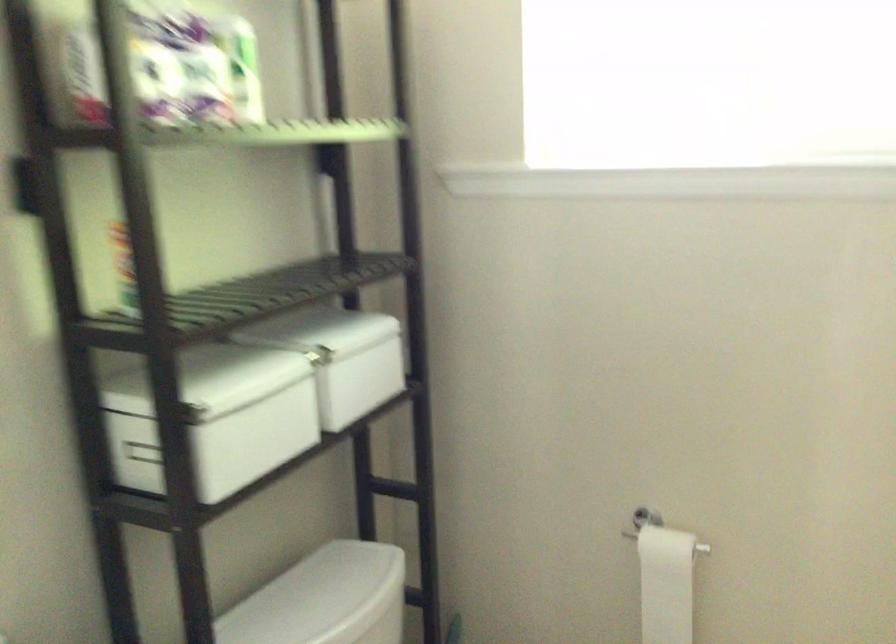
Find where to lift the white toilet lid. Please return your answer as a coordinate pair (x, y).

(325, 599)